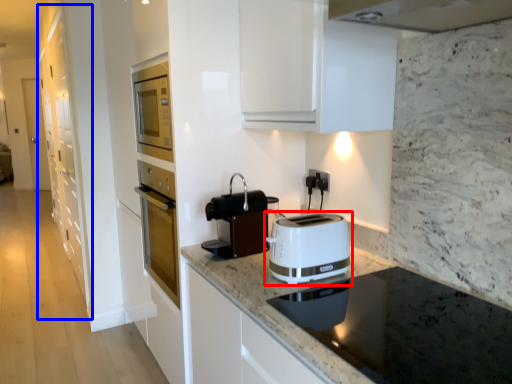
Question: Which object is further to the camera taking this photo, toaster (highlighted by a red box) or cabinetry (highlighted by a blue box)?

Choices:
 (A) toaster
 (B) cabinetry

Answer: (B)